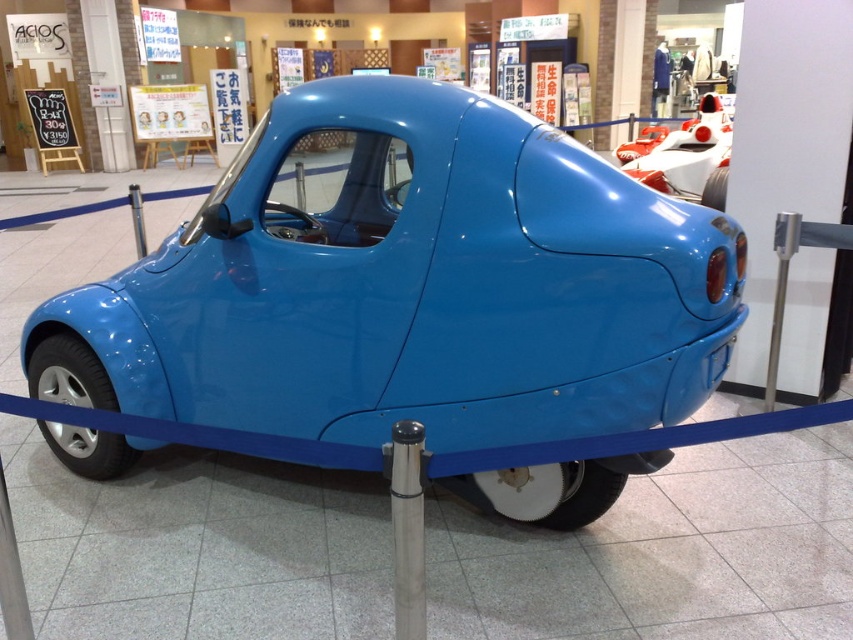
Question: Which object is farther from the camera taking this photo?

Choices:
 (A) white glossy race car at upper right
 (B) glossy blue car at center

Answer: (A)

Question: Can you confirm if glossy blue car at center is bigger than white glossy race car at upper right?

Choices:
 (A) yes
 (B) no

Answer: (A)

Question: Where is glossy blue car at center located in relation to white glossy race car at upper right in the image?

Choices:
 (A) right
 (B) left

Answer: (B)

Question: Can you confirm if glossy blue car at center is bigger than white glossy race car at upper right?

Choices:
 (A) no
 (B) yes

Answer: (B)